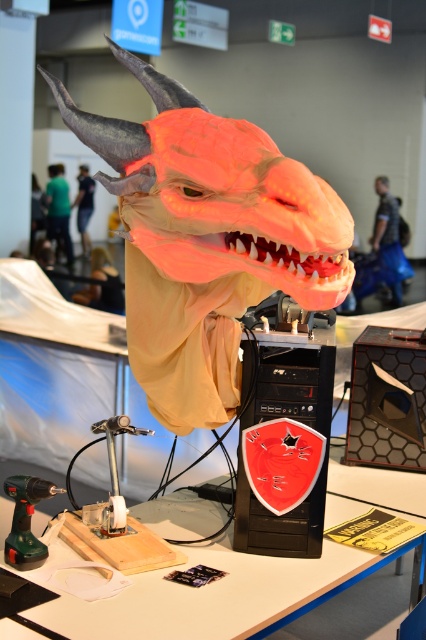
Can you confirm if rubber-like orange dragon head at center is taller than green plastic drill at lower left?

Indeed, rubber-like orange dragon head at center has a greater height compared to green plastic drill at lower left.

Between point (155, 157) and point (46, 548), which one is positioned in front?

Point (155, 157) is in front.

Measure the distance between rubber-like orange dragon head at center and camera.

4.68 feet

This screenshot has width=426, height=640. Find the location of `rubber-like orange dragon head at center`. rubber-like orange dragon head at center is located at coordinates (207, 240).

The height and width of the screenshot is (640, 426). What do you see at coordinates (207, 240) in the screenshot?
I see `rubber-like orange dragon head at center` at bounding box center [207, 240].

Between point (230, 157) and point (385, 186), which one is positioned in front?

Point (230, 157) is more forward.

Who is more distant from viewer, (187, 152) or (379, 186)?

Point (379, 186)

This screenshot has width=426, height=640. Find the location of `rubber-like orange dragon head at center`. rubber-like orange dragon head at center is located at coordinates (207, 240).

Does green plastic drill at lower left have a lesser height compared to matte orange mask at center?

Incorrect, green plastic drill at lower left's height does not fall short of matte orange mask at center's.

Is point (25, 488) positioned behind point (377, 186)?

No, (25, 488) is closer to viewer.

Locate an element on the screen. The height and width of the screenshot is (640, 426). green plastic drill at lower left is located at coordinates (25, 520).